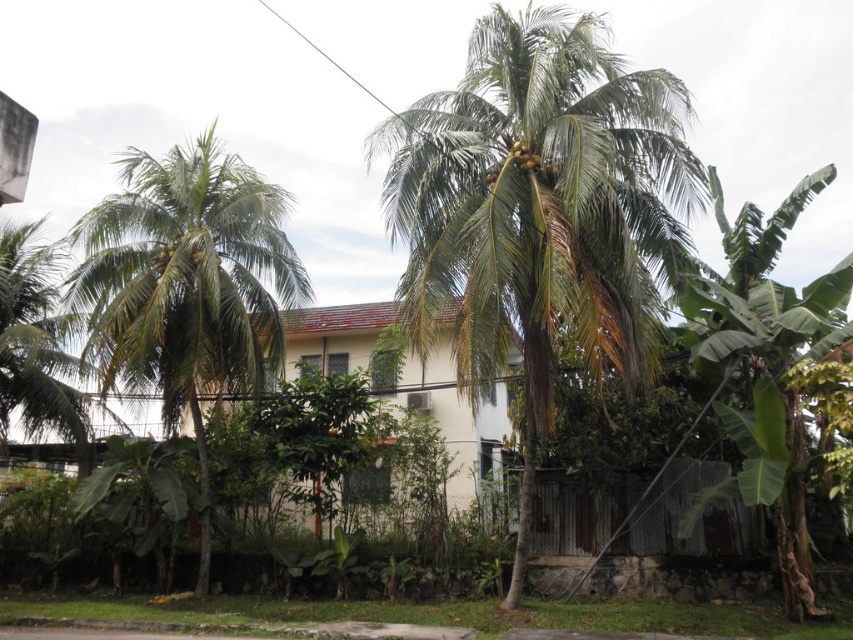
Question: Can you confirm if green leafy coconut tree at left is wider than green leafy coconut tree at right?

Choices:
 (A) no
 (B) yes

Answer: (B)

Question: Which point is closer to the camera taking this photo?

Choices:
 (A) (419, 124)
 (B) (228, 168)
 (C) (722, 324)

Answer: (A)

Question: Which object is positioned closest to the green leafy coconut tree at center?

Choices:
 (A) green leafy coconut tree at right
 (B) green leafy coconut tree at left

Answer: (A)

Question: Which of the following is the closest to the observer?

Choices:
 (A) green leafy coconut tree at right
 (B) green leafy coconut tree at center

Answer: (A)

Question: Can you confirm if green leafy coconut tree at center is bigger than green leafy coconut tree at left?

Choices:
 (A) no
 (B) yes

Answer: (A)

Question: Can you confirm if green leafy coconut tree at center is positioned below green leafy coconut tree at right?

Choices:
 (A) no
 (B) yes

Answer: (A)